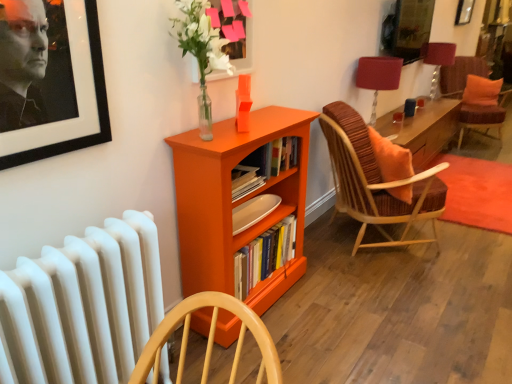
I want to click on orange fabric pillow at upper right, so click(481, 91).

Locate an element on the screen. The image size is (512, 384). matte red lampshade at upper right, the 2th table lamp in the left-to-right sequence is located at coordinates (437, 59).

Measure the distance between orange matte bookcase at center and camera.

orange matte bookcase at center and camera are 4.65 feet apart from each other.

This screenshot has height=384, width=512. I want to click on hardcover books at center, so click(x=264, y=256).

What do you see at coordinates (483, 116) in the screenshot? I see `velvet orange cushion at right, positioned as the first chair in right-to-left order` at bounding box center [483, 116].

Identify the location of wooden woven chair with orange cushion at right, which ranks as the first chair in front-to-back order. (375, 181).

What is the approximate width of wooden woven chair with orange cushion at right, the 1th chair positioned from the left?

It is 83.20 centimeters.

Find the location of a particular element. This screenshot has width=512, height=384. matte glass picture frame at upper center is located at coordinates (234, 31).

Can you confirm if orange matte bookcase at center is bigger than velvet orange cushion at right, the 1th chair positioned from the back?

No, orange matte bookcase at center is not bigger than velvet orange cushion at right, the 1th chair positioned from the back.

Considering the relative positions of orange matte bookcase at center and velvet orange cushion at right, which is counted as the 2th chair, starting from the front, in the image provided, is orange matte bookcase at center to the left of velvet orange cushion at right, which is counted as the 2th chair, starting from the front, from the viewer's perspective?

Indeed, orange matte bookcase at center is positioned on the left side of velvet orange cushion at right, which is counted as the 2th chair, starting from the front.

Considering their positions, is orange matte bookcase at center located in front of or behind velvet orange cushion at right, positioned as the first chair in right-to-left order?

Clearly, orange matte bookcase at center is in front of velvet orange cushion at right, positioned as the first chair in right-to-left order.

Is orange matte bookcase at center facing towards velvet orange cushion at right, which is counted as the 2th chair, starting from the front?

No, orange matte bookcase at center does not turn towards velvet orange cushion at right, which is counted as the 2th chair, starting from the front.

Can you confirm if hardcover books at center is wider than velvet orange cushion at right, which is counted as the 2th chair, starting from the front?

In fact, hardcover books at center might be narrower than velvet orange cushion at right, which is counted as the 2th chair, starting from the front.

Locate an element on the screen. the 2nd chair located above the hardcover books at center (from a real-world perspective) is located at coordinates click(483, 116).

Measure the distance from hardcover books at center to velvet orange cushion at right, the 1th chair positioned from the back.

hardcover books at center is 14.13 feet away from velvet orange cushion at right, the 1th chair positioned from the back.

From the image's perspective, does hardcover books at center appear higher than velvet orange cushion at right, which ranks as the second chair in left-to-right order?

No, from the image's perspective, hardcover books at center is not above velvet orange cushion at right, which ranks as the second chair in left-to-right order.

Would you say matte red lampshade at upper right, which ranks as the 2th table lamp in back-to-front order, is part of wooden woven chair with orange cushion at right, the second chair when ordered from right to left,'s contents?

No, matte red lampshade at upper right, which ranks as the 2th table lamp in back-to-front order, is located outside of wooden woven chair with orange cushion at right, the second chair when ordered from right to left.

Considering the positions of objects wooden woven chair with orange cushion at right, arranged as the second chair when viewed from the back, and matte red lampshade at upper right, which ranks as the first table lamp in bottom-to-top order, in the image provided, who is more to the left, wooden woven chair with orange cushion at right, arranged as the second chair when viewed from the back, or matte red lampshade at upper right, which ranks as the first table lamp in bottom-to-top order,?

From the viewer's perspective, wooden woven chair with orange cushion at right, arranged as the second chair when viewed from the back, appears more on the left side.

In terms of height, does wooden woven chair with orange cushion at right, the second chair when ordered from right to left, look taller or shorter compared to matte red lampshade at upper right, which is the 2th table lamp from right to left?

Considering their sizes, wooden woven chair with orange cushion at right, the second chair when ordered from right to left, has more height than matte red lampshade at upper right, which is the 2th table lamp from right to left.

Based on the photo, which object is closer to the camera taking this photo, wooden woven chair with orange cushion at right, which ranks as the first chair in front-to-back order, or matte red lampshade at upper right, which is the 2th table lamp from right to left?

wooden woven chair with orange cushion at right, which ranks as the first chair in front-to-back order, is in front.

Which is more to the right, matte glass picture frame at upper center or matte red lampshade at upper right, which ranks as the first table lamp in bottom-to-top order?

matte red lampshade at upper right, which ranks as the first table lamp in bottom-to-top order.

From the image's perspective, which is above, matte glass picture frame at upper center or matte red lampshade at upper right, which is the 2th table lamp from right to left?

From the image's view, matte glass picture frame at upper center is above.

From a real-world perspective, which table lamp is the 2nd one underneath the matte glass picture frame at upper center? Please provide its 2D coordinates.

[(378, 77)]

Considering the sizes of objects matte glass picture frame at upper center and matte red lampshade at upper right, the 1th table lamp from the front, in the image provided, who is thinner, matte glass picture frame at upper center or matte red lampshade at upper right, the 1th table lamp from the front,?

Thinner between the two is matte glass picture frame at upper center.

Could you tell me if matte red lampshade at upper right, placed as the 1th table lamp when sorted from right to left, is turned towards white matte radiator at lower left?

No, matte red lampshade at upper right, placed as the 1th table lamp when sorted from right to left, does not turn towards white matte radiator at lower left.

How much distance is there between matte red lampshade at upper right, arranged as the 2th table lamp when viewed from the front, and white matte radiator at lower left?

4.14 meters.

I want to click on the 2nd table lamp behind the white matte radiator at lower left, starting your count from the anchor, so click(x=437, y=59).

From the picture: From a real-world perspective, is matte red lampshade at upper right, arranged as the 2th table lamp when viewed from the front, located higher than white matte radiator at lower left?

Yes, from a real-world perspective, matte red lampshade at upper right, arranged as the 2th table lamp when viewed from the front, is over white matte radiator at lower left

This screenshot has height=384, width=512. Find the location of `book that appears below the white matte radiator at lower left (from a real-world perspective)`. book that appears below the white matte radiator at lower left (from a real-world perspective) is located at coordinates (264, 256).

Is hardcover books at center completely or partially inside white matte radiator at lower left?

No, hardcover books at center is not a part of white matte radiator at lower left.

From a real-world perspective, between white matte radiator at lower left and hardcover books at center, who is vertically higher?

white matte radiator at lower left is physically above.

Does hardcover books at center touch orange matte bookcase at center?

No, hardcover books at center is not beside orange matte bookcase at center.

Is hardcover books at center smaller than orange matte bookcase at center?

Yes.

How different are the orientations of hardcover books at center and orange matte bookcase at center in degrees?

5.02e-05 degrees separate the facing orientations of hardcover books at center and orange matte bookcase at center.

Find the location of a particular element. The width and height of the screenshot is (512, 384). bookcase above the velvet orange cushion at right, which ranks as the second chair in left-to-right order (from a real-world perspective) is located at coordinates (236, 202).

Where is `chair that is the 2nd one when counting rightward from the hardcover books at center`? Image resolution: width=512 pixels, height=384 pixels. chair that is the 2nd one when counting rightward from the hardcover books at center is located at coordinates (483, 116).

Which object lies nearer to the anchor point matte red lampshade at upper right, which ranks as the first table lamp in bottom-to-top order, matte red lampshade at upper right, which is counted as the 1th table lamp, starting from the back, or orange fabric pillow at upper right?

matte red lampshade at upper right, which is counted as the 1th table lamp, starting from the back, is positioned closer to the anchor matte red lampshade at upper right, which ranks as the first table lamp in bottom-to-top order.

Which object lies further to the anchor point matte glass picture frame at upper center, orange matte bookcase at center or orange fabric pillow at upper right?

The object further to matte glass picture frame at upper center is orange fabric pillow at upper right.

Estimate the real-world distances between objects in this image. Which object is further from matte glass picture frame at upper center, wooden woven chair with orange cushion at right, marked as the first chair in a bottom-to-top arrangement, or hardcover books at center?

Based on the image, wooden woven chair with orange cushion at right, marked as the first chair in a bottom-to-top arrangement, appears to be further to matte glass picture frame at upper center.

Looking at the image, which one is located closer to orange fabric pillow at upper right, velvet orange cushion at right, positioned as the first chair in right-to-left order, or matte glass picture frame at upper center?

velvet orange cushion at right, positioned as the first chair in right-to-left order, lies closer to orange fabric pillow at upper right than the other object.

From the image, which object appears to be nearer to white matte radiator at lower left, hardcover books at center or matte red lampshade at upper right, which ranks as the 2th table lamp in back-to-front order?

Based on the image, hardcover books at center appears to be nearer to white matte radiator at lower left.

Considering their positions, is matte glass picture frame at upper center positioned closer to wooden woven chair with orange cushion at right, arranged as the second chair when viewed from the back, than velvet orange cushion at right, which ranks as the second chair in left-to-right order?

Among the two, matte glass picture frame at upper center is located nearer to wooden woven chair with orange cushion at right, arranged as the second chair when viewed from the back.

Considering their positions, is hardcover books at center positioned closer to orange fabric pillow at upper right than orange matte bookcase at center?

hardcover books at center lies closer to orange fabric pillow at upper right than the other object.

From the image, which object appears to be nearer to matte red lampshade at upper right, acting as the 1th table lamp starting from the left, wooden woven chair with orange cushion at right, marked as the first chair in a bottom-to-top arrangement, or matte glass picture frame at upper center?

A: wooden woven chair with orange cushion at right, marked as the first chair in a bottom-to-top arrangement.

This screenshot has width=512, height=384. What are the coordinates of `picture frame between white matte radiator at lower left and orange fabric pillow at upper right in the front-back direction` in the screenshot? It's located at point(234,31).

Locate an element on the screen. The width and height of the screenshot is (512, 384). book located between white matte radiator at lower left and matte red lampshade at upper right, which ranks as the 2th table lamp in back-to-front order, in the depth direction is located at coordinates (264, 256).

The image size is (512, 384). Identify the location of picture frame between orange matte bookcase at center and matte red lampshade at upper right, the 2th table lamp in the left-to-right sequence, along the z-axis. (234, 31).

The image size is (512, 384). In order to click on chair between white matte radiator at lower left and velvet orange cushion at right, positioned as the first chair in right-to-left order, along the z-axis in this screenshot , I will do `click(375, 181)`.